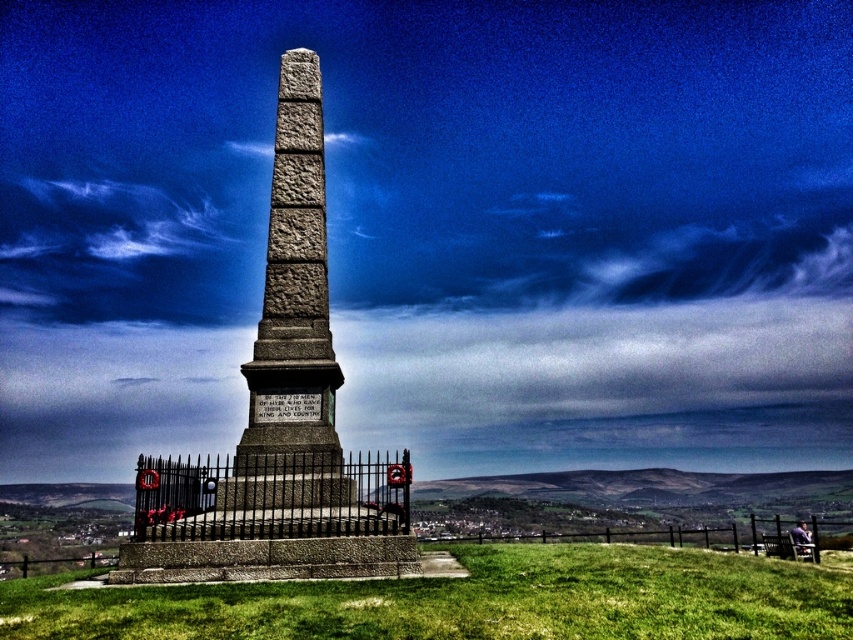
Question: Which object is farther from the camera taking this photo?

Choices:
 (A) granite obelisk at center
 (B) green grass at center

Answer: (A)

Question: Which point appears farthest from the camera in this image?

Choices:
 (A) [x=264, y=593]
 (B) [x=357, y=490]

Answer: (B)

Question: Is granite obelisk at center bigger than green grass at center?

Choices:
 (A) yes
 (B) no

Answer: (A)

Question: Considering the relative positions of granite obelisk at center and green grass at center in the image provided, where is granite obelisk at center located with respect to green grass at center?

Choices:
 (A) right
 (B) left

Answer: (B)

Question: Does granite obelisk at center lie in front of green grass at center?

Choices:
 (A) no
 (B) yes

Answer: (A)